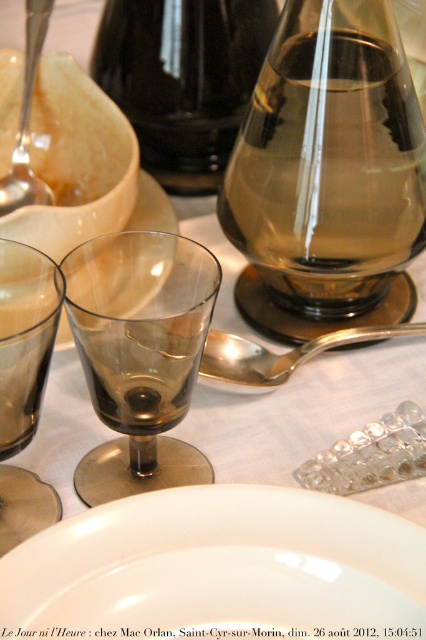
Question: Which object is the closest to the metallic spoon at upper left?

Choices:
 (A) brown glass at center
 (B) brown translucent wine glass at left
 (C) transparent glass at center
 (D) silver/golden metallic spoon at center

Answer: (C)

Question: Based on their relative distances, which object is nearer to the transparent glass at center?

Choices:
 (A) metallic spoon at upper left
 (B) brown translucent wine glass at left

Answer: (A)

Question: Can you confirm if brown glass at center is thinner than brown translucent wine glass at left?

Choices:
 (A) yes
 (B) no

Answer: (B)

Question: Which point appears farthest from the camera in this image?

Choices:
 (A) (17, 481)
 (B) (31, 86)

Answer: (B)

Question: Does white glossy platter at center come in front of metallic spoon at upper left?

Choices:
 (A) no
 (B) yes

Answer: (B)

Question: Is brown translucent wine glass at left below silver/golden metallic spoon at center?

Choices:
 (A) no
 (B) yes

Answer: (B)